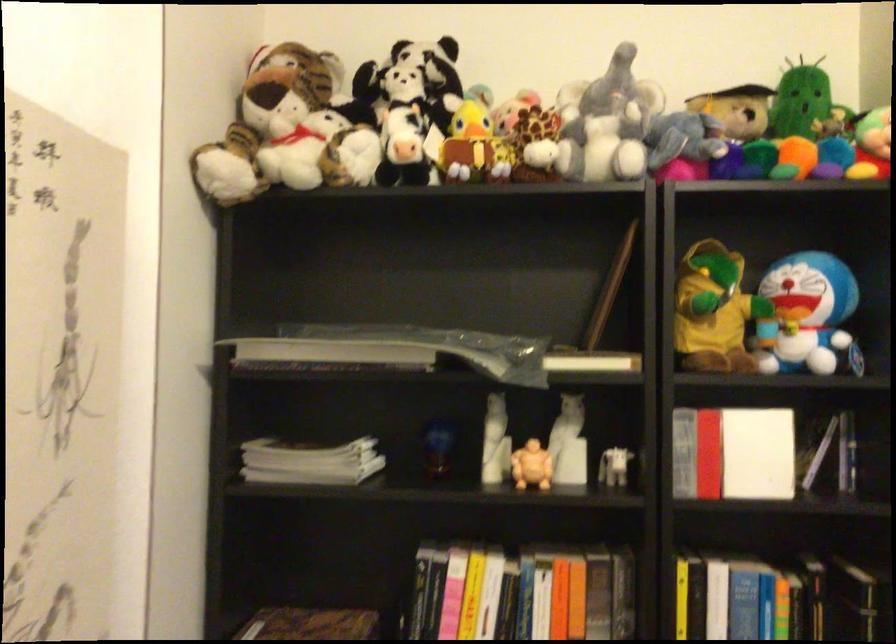
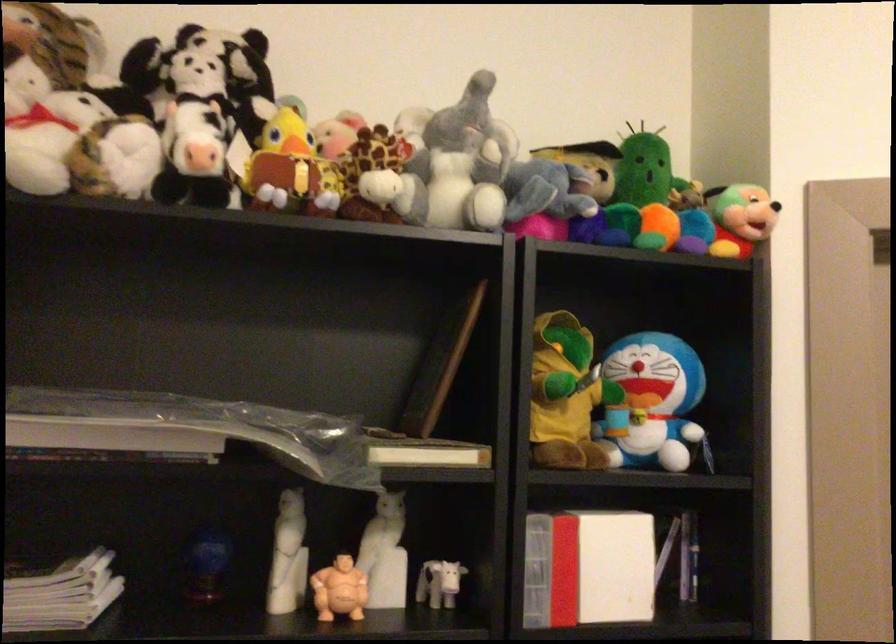
Locate, in the second image, the point that corresponds to point (711, 310) in the first image.

(565, 395)